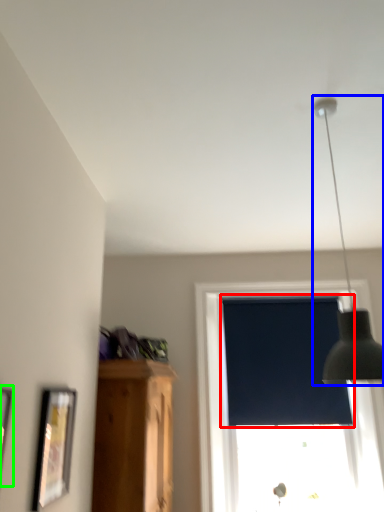
Question: Based on their relative distances, which object is nearer to window screen (highlighted by a red box)? Choose from lamp (highlighted by a blue box) and picture frame (highlighted by a green box).

Choices:
 (A) lamp
 (B) picture frame

Answer: (A)